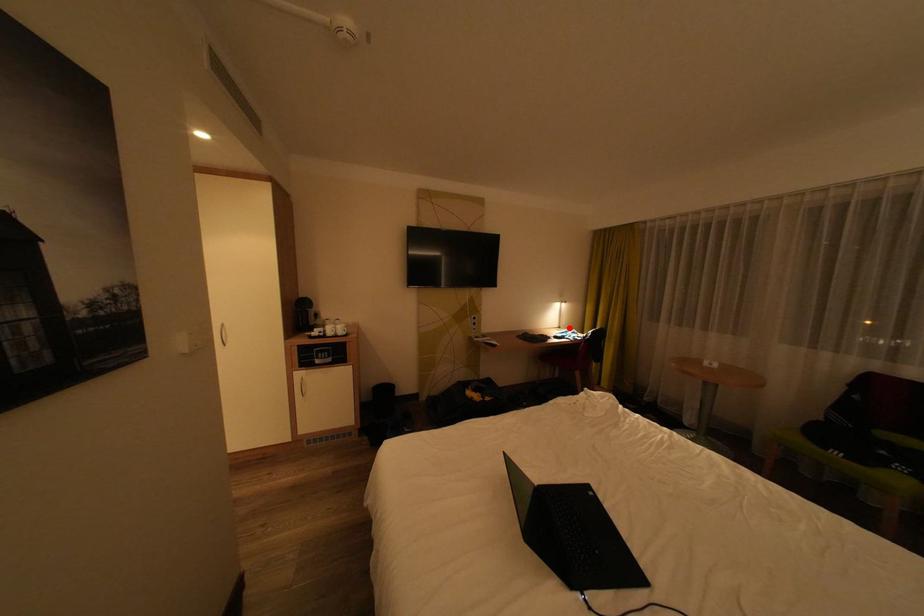
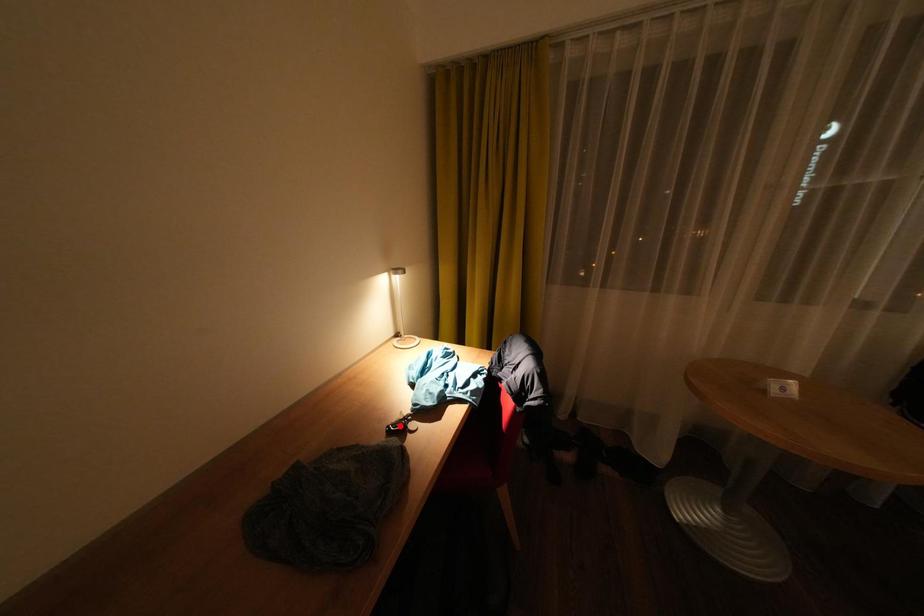
I am providing you with two images of the same scene from different viewpoints. A red point is marked on the first image and another point is marked on the second image. Do the highlighted points in image1 and image2 indicate the same real-world spot?

No